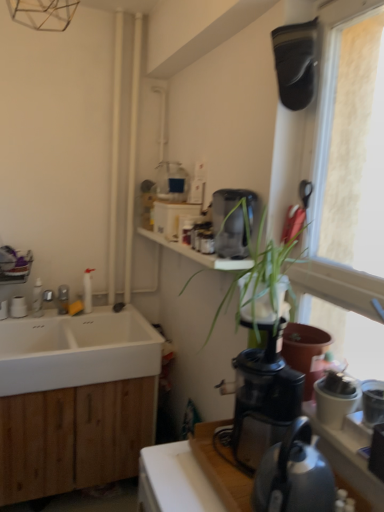
Question: Is metallic gray kettle at lower right not within wooden countertop at lower right?

Choices:
 (A) yes
 (B) no

Answer: (A)

Question: Does metallic gray kettle at lower right come in front of wooden countertop at lower right?

Choices:
 (A) no
 (B) yes

Answer: (B)

Question: Considering the relative sizes of metallic gray kettle at lower right and wooden countertop at lower right in the image provided, is metallic gray kettle at lower right thinner than wooden countertop at lower right?

Choices:
 (A) no
 (B) yes

Answer: (B)

Question: Considering the relative positions of metallic gray kettle at lower right and wooden countertop at lower right in the image provided, is metallic gray kettle at lower right to the left of wooden countertop at lower right from the viewer's perspective?

Choices:
 (A) yes
 (B) no

Answer: (B)

Question: Is metallic gray kettle at lower right in contact with wooden countertop at lower right?

Choices:
 (A) yes
 (B) no

Answer: (B)

Question: Is green leafy plant at upper right in front of or behind white matte sink at lower left in the image?

Choices:
 (A) behind
 (B) front

Answer: (B)

Question: Is point (279, 271) positioned closer to the camera than point (148, 370)?

Choices:
 (A) farther
 (B) closer

Answer: (B)

Question: In terms of height, does green leafy plant at upper right look taller or shorter compared to white matte sink at lower left?

Choices:
 (A) tall
 (B) short

Answer: (A)

Question: Considering the positions of green leafy plant at upper right and white matte sink at lower left in the image, is green leafy plant at upper right bigger or smaller than white matte sink at lower left?

Choices:
 (A) small
 (B) big

Answer: (A)

Question: From a real-world perspective, is green leafy plant at upper right physically located above or below satin black coffee maker at upper center, placed as the second coffee maker when sorted from front to back?

Choices:
 (A) below
 (B) above

Answer: (A)

Question: Is green leafy plant at upper right inside or outside of satin black coffee maker at upper center, acting as the 2th coffee maker starting from the bottom?

Choices:
 (A) outside
 (B) inside

Answer: (A)

Question: Considering the positions of point (274, 327) and point (256, 195), is point (274, 327) closer or farther from the camera than point (256, 195)?

Choices:
 (A) farther
 (B) closer

Answer: (B)

Question: In terms of size, does green leafy plant at upper right appear bigger or smaller than satin black coffee maker at upper center, placed as the second coffee maker when sorted from front to back?

Choices:
 (A) small
 (B) big

Answer: (B)

Question: From a real-world perspective, is green leafy plant at upper right above or below black plastic coffee maker at center-right, which is counted as the 1th coffee maker, starting from the bottom?

Choices:
 (A) above
 (B) below

Answer: (A)

Question: In terms of height, does green leafy plant at upper right look taller or shorter compared to black plastic coffee maker at center-right, which is counted as the 1th coffee maker, starting from the bottom?

Choices:
 (A) short
 (B) tall

Answer: (B)